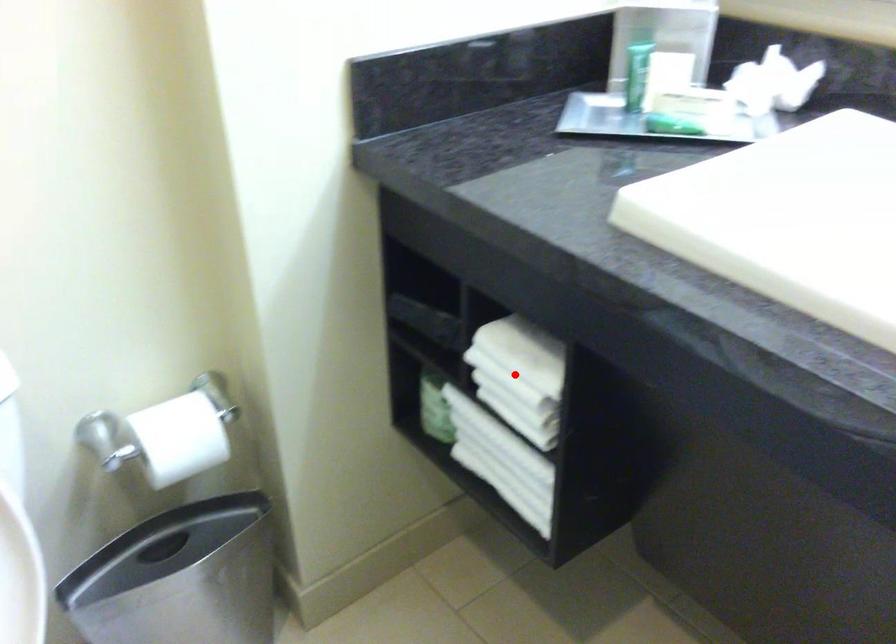
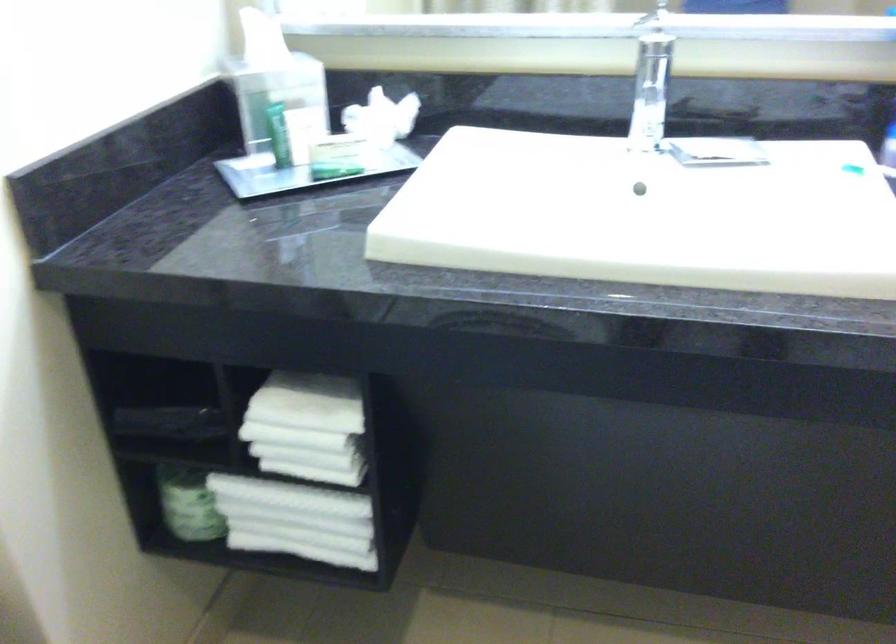
Locate, in the second image, the point that corresponds to the highlighted location in the first image.

(307, 428)